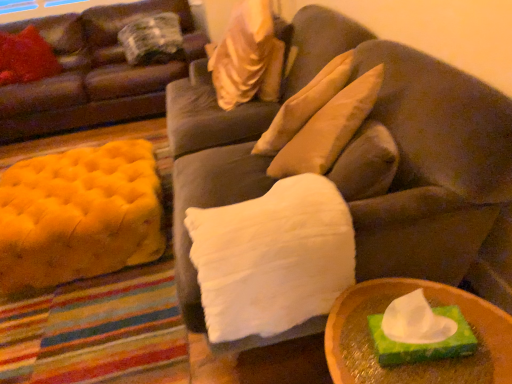
Find the location of a particular element. empty space that is ontop of wooden tray at lower right (from a real-world perspective) is located at coordinates (425, 350).